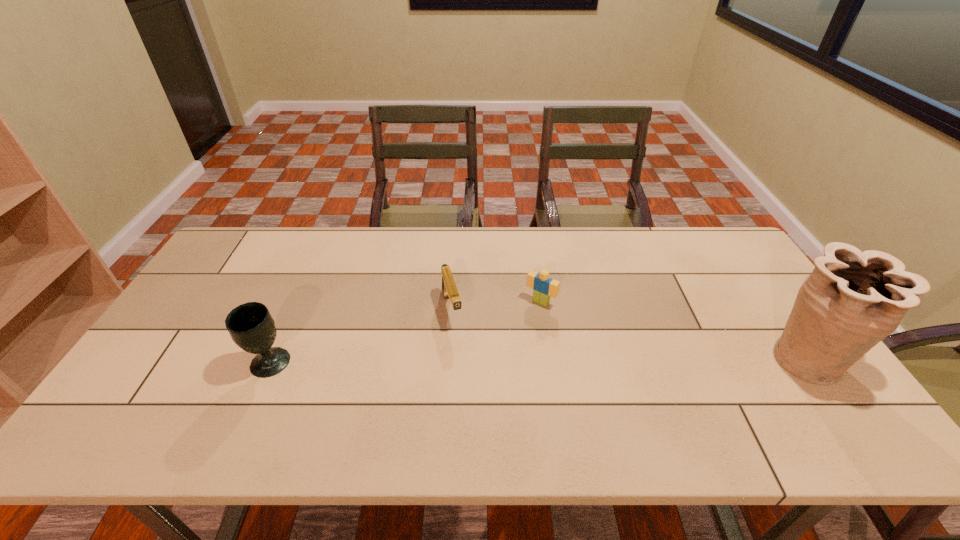
You are a GUI agent. You are given a task and a screenshot of the screen. Output one action in this format:
    pyautogui.click(x=<x>, y=<y>)
    Task: Click on the vacant space on the desktop that is between the third shortest object and the tallest object and is positioned at the barrel of the pistol
    This screenshot has width=960, height=540.
    Given the screenshot: What is the action you would take?
    pyautogui.click(x=468, y=362)

What are the coordinates of `free space on the desktop that is between the chalice and the tallest object and is positioned on the face of the Lego` in the screenshot? It's located at (492, 362).